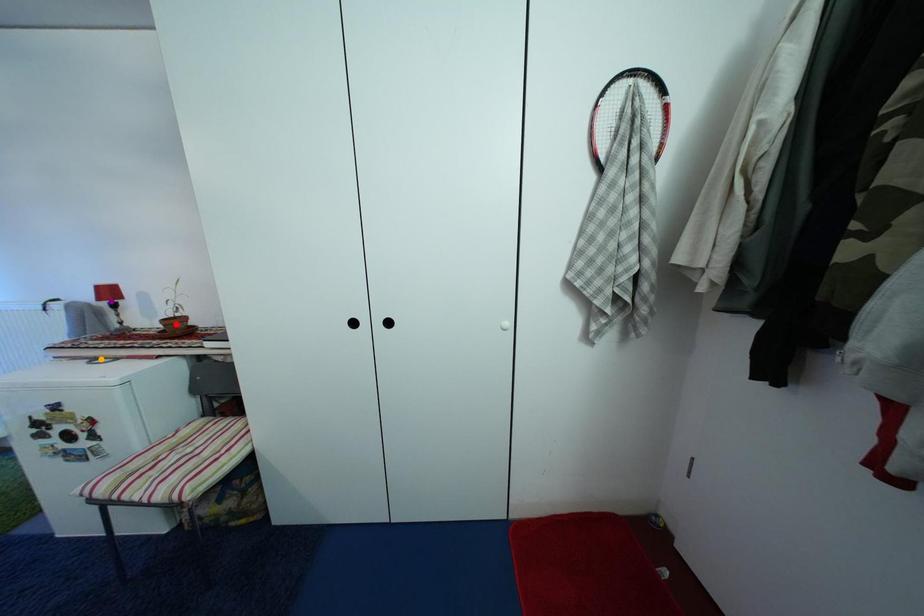
Looking at this image, order these from nearest to farthest:
A) red point
B) orange point
C) purple point

purple point < red point < orange point